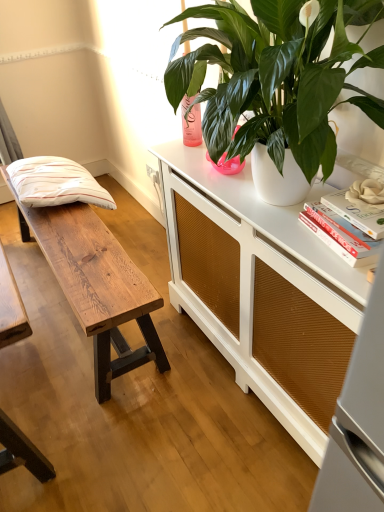
Find the location of a particular element. blank area to the left of white matte book at upper right, the first book positioned from the top is located at coordinates (291, 229).